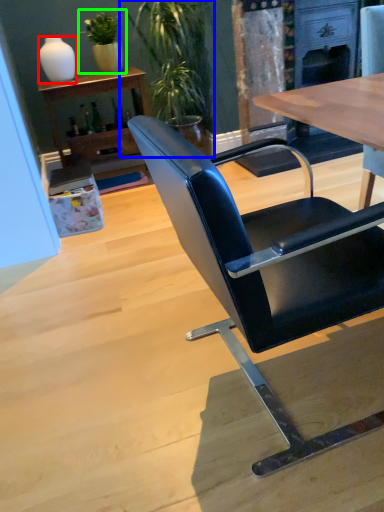
Question: Based on their relative distances, which object is farther from vase (highlighted by a red box)? Choose from houseplant (highlighted by a blue box) and houseplant (highlighted by a green box).

Choices:
 (A) houseplant
 (B) houseplant

Answer: (A)